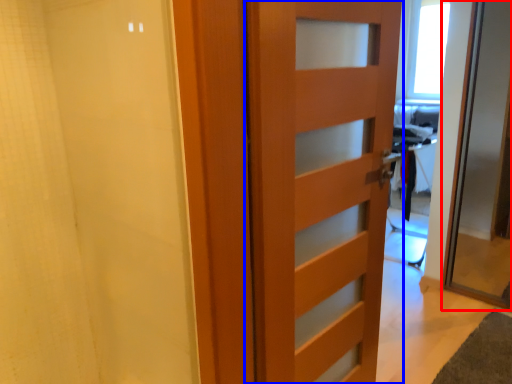
Question: Which of the following is the farthest to the observer, door (highlighted by a red box) or door (highlighted by a blue box)?

Choices:
 (A) door
 (B) door

Answer: (A)